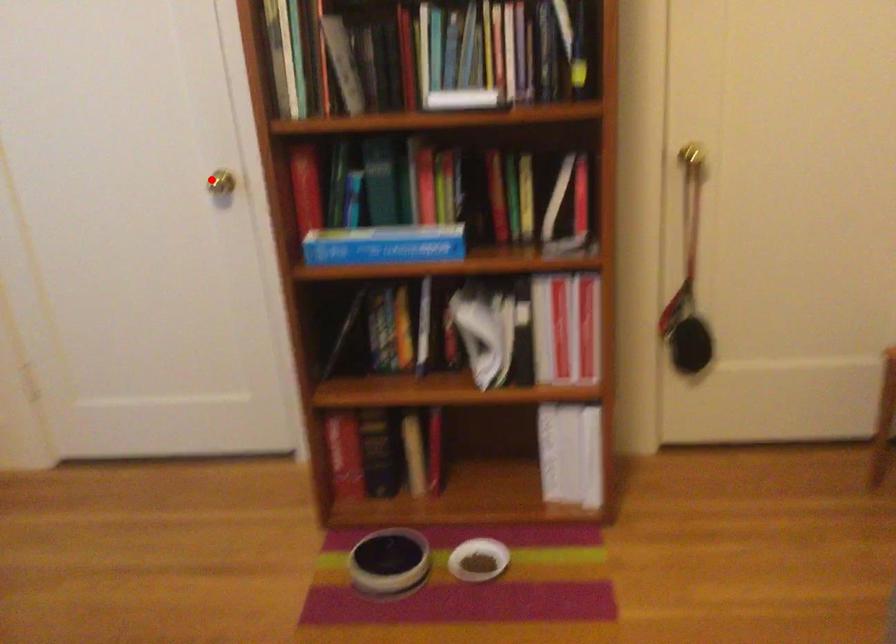
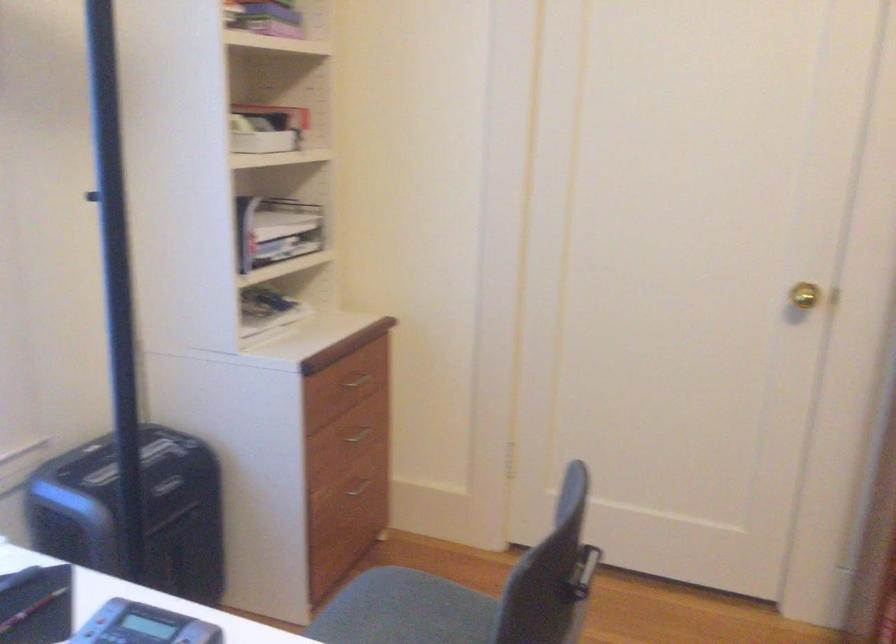
Locate, in the second image, the point that corresponds to the highlighted location in the first image.

(804, 295)